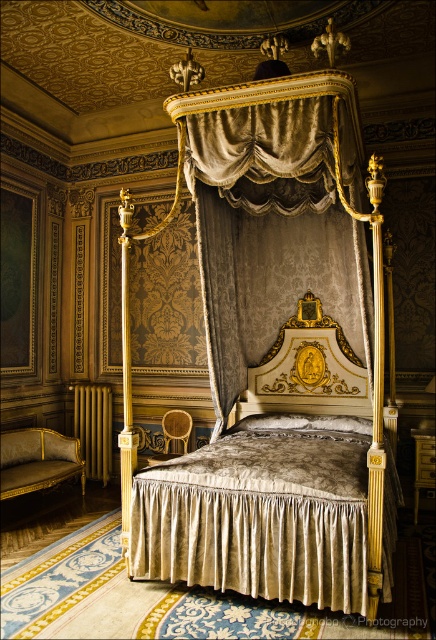
Can you confirm if velvet/golden bedskirt at center is taller than gold velvet headboard at center?

Incorrect, velvet/golden bedskirt at center's height is not larger of gold velvet headboard at center's.

Measure the distance between point (309, 480) and camera.

Point (309, 480) is 3.45 meters away from camera.

Which is in front, point (207, 531) or point (353, 371)?

Positioned in front is point (207, 531).

The image size is (436, 640). I want to click on velvet/golden bedskirt at center, so click(262, 512).

Between velvet/golden drapery at center and gold velvet headboard at center, which one has less height?

Standing shorter between the two is gold velvet headboard at center.

Is point (323, 140) more distant than point (303, 385)?

No.

Image resolution: width=436 pixels, height=640 pixels. I want to click on velvet/golden drapery at center, so click(x=269, y=234).

This screenshot has height=640, width=436. What do you see at coordinates (262, 512) in the screenshot?
I see `velvet/golden bedskirt at center` at bounding box center [262, 512].

Looking at this image, which is below, velvet/golden bedskirt at center or velvet/golden drapery at center?

velvet/golden bedskirt at center

Is point (360, 483) less distant than point (302, 264)?

Yes.

This screenshot has height=640, width=436. Identify the location of velvet/golden bedskirt at center. (262, 512).